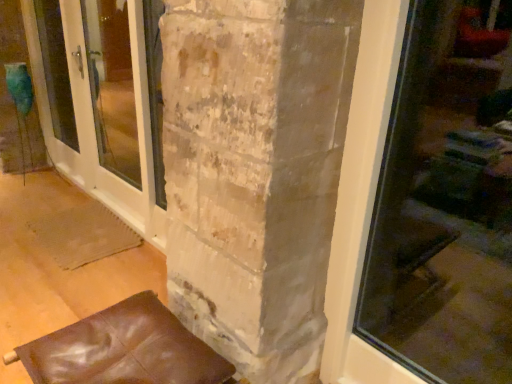
I want to click on free space in front of white glossy screen door at left, so click(x=72, y=251).